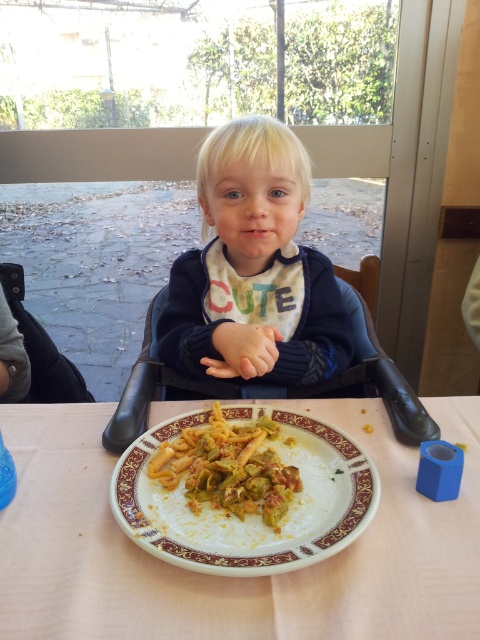
Question: Among these objects, which one is farthest from the camera?

Choices:
 (A) white glossy plate at lower center
 (B) white ceramic plate at center

Answer: (A)

Question: Which object is the farthest from the yellowish matte pasta at center?

Choices:
 (A) white ceramic plate at center
 (B) cute sweater at center

Answer: (B)

Question: Is cute sweater at center further to camera compared to white glossy plate at lower center?

Choices:
 (A) yes
 (B) no

Answer: (A)

Question: Does white ceramic plate at center have a smaller size compared to white glossy plate at lower center?

Choices:
 (A) no
 (B) yes

Answer: (A)

Question: Which point is farther from the camera taking this photo?

Choices:
 (A) (x=163, y=317)
 (B) (x=226, y=445)

Answer: (A)

Question: Is cute sweater at center to the left of yellowish matte pasta at center from the viewer's perspective?

Choices:
 (A) no
 (B) yes

Answer: (B)